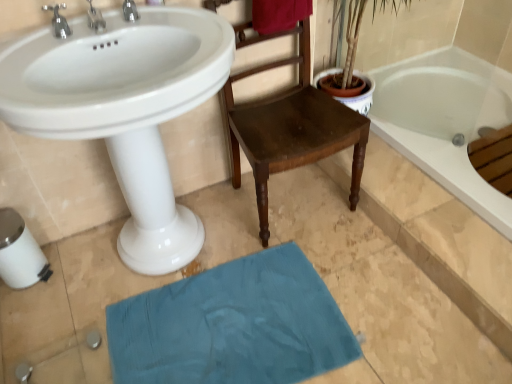
Where is `white plastic toilet paper at lower left`? white plastic toilet paper at lower left is located at coordinates (20, 252).

At what (x,y) coordinates should I click in order to perform the action: click on silver metallic tap at upper left, which is counted as the 3th tap, starting from the left. Please return your answer as a coordinate pair (x, y). This screenshot has width=512, height=384. Looking at the image, I should click on (130, 11).

What do you see at coordinates (232, 325) in the screenshot? This screenshot has height=384, width=512. I see `teal fabric bath mat at lower center` at bounding box center [232, 325].

Where is `white glossy bathtub at upper right`? The width and height of the screenshot is (512, 384). white glossy bathtub at upper right is located at coordinates (445, 121).

Describe the element at coordinates (278, 14) in the screenshot. I see `velvet red towel at upper center` at that location.

The image size is (512, 384). I want to click on silver metallic faucet at upper left, positioned as the 3th tap in right-to-left order, so click(58, 21).

The width and height of the screenshot is (512, 384). Identify the location of white plastic toilet paper at lower left. (20, 252).

Would you say silver metallic tap at upper left, which ranks as the first tap in right-to-left order, is to the left or to the right of silver metallic faucet at upper left, placed as the 1th tap when sorted from left to right, in the picture?

Clearly, silver metallic tap at upper left, which ranks as the first tap in right-to-left order, is on the right of silver metallic faucet at upper left, placed as the 1th tap when sorted from left to right, in the image.

How much distance is there between silver metallic tap at upper left, which ranks as the first tap in right-to-left order, and silver metallic faucet at upper left, placed as the 1th tap when sorted from left to right?

silver metallic tap at upper left, which ranks as the first tap in right-to-left order, is 7.36 inches from silver metallic faucet at upper left, placed as the 1th tap when sorted from left to right.

Between silver metallic tap at upper left, which is counted as the 3th tap, starting from the left, and silver metallic faucet at upper left, placed as the 1th tap when sorted from left to right, which one is positioned behind?

silver metallic tap at upper left, which is counted as the 3th tap, starting from the left, is further away from the camera.

In the scene shown: How many degrees apart are the facing directions of silver metallic tap at upper left, which ranks as the first tap in right-to-left order, and silver metallic faucet at upper left, positioned as the 3th tap in right-to-left order?

silver metallic tap at upper left, which ranks as the first tap in right-to-left order, and silver metallic faucet at upper left, positioned as the 3th tap in right-to-left order, are facing 0.00145 degrees away from each other.

Based on the photo, what's the angular difference between white glossy sink at upper left and silver metallic faucet at upper left, placed as the 1th tap when sorted from left to right,'s facing directions?

white glossy sink at upper left and silver metallic faucet at upper left, placed as the 1th tap when sorted from left to right, are facing 0.00141 degrees away from each other.

Considering the sizes of white glossy sink at upper left and silver metallic faucet at upper left, positioned as the 3th tap in right-to-left order, in the image, is white glossy sink at upper left wider or thinner than silver metallic faucet at upper left, positioned as the 3th tap in right-to-left order,?

Clearly, white glossy sink at upper left has more width compared to silver metallic faucet at upper left, positioned as the 3th tap in right-to-left order.

Which object is further away from the camera, white glossy sink at upper left or silver metallic faucet at upper left, placed as the 1th tap when sorted from left to right?

silver metallic faucet at upper left, placed as the 1th tap when sorted from left to right, is more distant.

Is point (394, 78) positioned in front of point (303, 16)?

That is False.

Which of these two, white glossy bathtub at upper right or velvet red towel at upper center, is bigger?

Bigger between the two is white glossy bathtub at upper right.

In the image, is white glossy bathtub at upper right positioned in front of or behind velvet red towel at upper center?

white glossy bathtub at upper right is behind velvet red towel at upper center.

Measure the distance between white glossy bathtub at upper right and velvet red towel at upper center.

white glossy bathtub at upper right and velvet red towel at upper center are 32.66 inches apart from each other.

From a real-world perspective, who is located lower, white glossy bathtub at upper right or wooden chair at center?

white glossy bathtub at upper right, from a real-world perspective.

Would you say white glossy bathtub at upper right is outside wooden chair at center?

Yes, white glossy bathtub at upper right is not within wooden chair at center.

From the image's perspective, is white glossy bathtub at upper right above wooden chair at center?

Yes, from the image's perspective, white glossy bathtub at upper right is above wooden chair at center.

Is white glossy bathtub at upper right to the right of silver metallic faucet at upper left, positioned as the 3th tap in right-to-left order, from the viewer's perspective?

Yes.

Is white glossy bathtub at upper right spatially inside silver metallic faucet at upper left, placed as the 1th tap when sorted from left to right, or outside of it?

white glossy bathtub at upper right cannot be found inside silver metallic faucet at upper left, placed as the 1th tap when sorted from left to right.

Is white glossy bathtub at upper right taller than silver metallic faucet at upper left, placed as the 1th tap when sorted from left to right?

No.

Can you tell me how much silver metallic tap at upper left, which is counted as the 3th tap, starting from the left, and silver metallic faucet at upper left, the second tap in the right-to-left sequence, differ in facing direction?

The facing directions of silver metallic tap at upper left, which is counted as the 3th tap, starting from the left, and silver metallic faucet at upper left, the second tap in the right-to-left sequence, are 0.000585 degrees apart.

In the scene shown: From a real-world perspective, is silver metallic tap at upper left, which is counted as the 3th tap, starting from the left, physically located above or below silver metallic faucet at upper left, the second tap from the left?

Clearly, from a real-world perspective, silver metallic tap at upper left, which is counted as the 3th tap, starting from the left, is below silver metallic faucet at upper left, the second tap from the left.

Which object is positioned more to the right, silver metallic tap at upper left, which ranks as the first tap in right-to-left order, or silver metallic faucet at upper left, the second tap in the right-to-left sequence?

silver metallic tap at upper left, which ranks as the first tap in right-to-left order, is more to the right.

Is silver metallic tap at upper left, which ranks as the first tap in right-to-left order, bigger than silver metallic faucet at upper left, the second tap in the right-to-left sequence?

Actually, silver metallic tap at upper left, which ranks as the first tap in right-to-left order, might be smaller than silver metallic faucet at upper left, the second tap in the right-to-left sequence.

Which of these two, white plastic toilet paper at lower left or white glossy sink at upper left, is wider?

white glossy sink at upper left.

Who is shorter, white plastic toilet paper at lower left or white glossy sink at upper left?

Standing shorter between the two is white plastic toilet paper at lower left.

Is white glossy sink at upper left a part of white plastic toilet paper at lower left?

Definitely not — white glossy sink at upper left is not inside white plastic toilet paper at lower left.

Which of these two, white plastic toilet paper at lower left or white glossy sink at upper left, is smaller?

white plastic toilet paper at lower left.

Identify the location of tap above the silver metallic faucet at upper left, placed as the 1th tap when sorted from left to right (from the image's perspective). The height and width of the screenshot is (384, 512). (130, 11).

The height and width of the screenshot is (384, 512). Identify the location of sink in front of the silver metallic faucet at upper left, placed as the 1th tap when sorted from left to right. (124, 109).

Looking at this image, estimate the real-world distances between objects in this image. Which object is closer to white plastic toilet paper at lower left, silver metallic faucet at upper left, the second tap from the left, or velvet red towel at upper center?

silver metallic faucet at upper left, the second tap from the left, lies closer to white plastic toilet paper at lower left than the other object.

Considering their positions, is silver metallic faucet at upper left, positioned as the 3th tap in right-to-left order, positioned further to white plastic toilet paper at lower left than teal fabric bath mat at lower center?

The object further to white plastic toilet paper at lower left is silver metallic faucet at upper left, positioned as the 3th tap in right-to-left order.

Looking at this image, when comparing their distances from white glossy bathtub at upper right, does silver metallic faucet at upper left, placed as the 1th tap when sorted from left to right, or velvet red towel at upper center seem further?

silver metallic faucet at upper left, placed as the 1th tap when sorted from left to right.

When comparing their distances from white glossy sink at upper left, does silver metallic tap at upper left, which is counted as the 3th tap, starting from the left, or velvet red towel at upper center seem further?

Among the two, velvet red towel at upper center is located further to white glossy sink at upper left.

Looking at this image, estimate the real-world distances between objects in this image. Which object is further from silver metallic tap at upper left, which ranks as the first tap in right-to-left order, white glossy sink at upper left or wooden chair at center?

wooden chair at center is positioned further to the anchor silver metallic tap at upper left, which ranks as the first tap in right-to-left order.

When comparing their distances from wooden chair at center, does silver metallic faucet at upper left, the second tap in the right-to-left sequence, or velvet red towel at upper center seem closer?

Based on the image, velvet red towel at upper center appears to be nearer to wooden chair at center.

When comparing their distances from teal fabric bath mat at lower center, does silver metallic faucet at upper left, the second tap from the left, or wooden chair at center seem closer?

wooden chair at center.

Which object lies further to the anchor point teal fabric bath mat at lower center, silver metallic tap at upper left, which ranks as the first tap in right-to-left order, or wooden chair at center?

The object further to teal fabric bath mat at lower center is silver metallic tap at upper left, which ranks as the first tap in right-to-left order.

Where is `tap that lies between silver metallic faucet at upper left, positioned as the 3th tap in right-to-left order, and white glossy sink at upper left from top to bottom`? tap that lies between silver metallic faucet at upper left, positioned as the 3th tap in right-to-left order, and white glossy sink at upper left from top to bottom is located at coordinates (95, 18).

In order to click on chair that lies between velvet red towel at upper center and white glossy sink at upper left from top to bottom in this screenshot , I will do `click(289, 125)`.

The height and width of the screenshot is (384, 512). In order to click on sink between velvet red towel at upper center and teal fabric bath mat at lower center in the vertical direction in this screenshot , I will do `click(124, 109)`.

In order to click on sink between silver metallic faucet at upper left, positioned as the 3th tap in right-to-left order, and velvet red towel at upper center from left to right in this screenshot , I will do `click(124, 109)`.